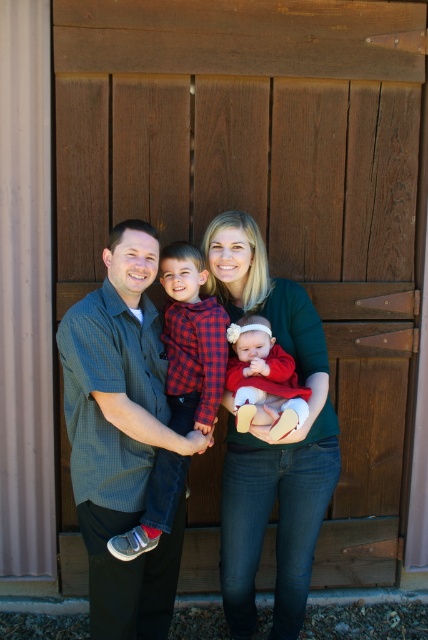
You are a tailor measuring shirts for a family photo. You have two shirts to compare in the image. Which shirt has a larger width between the green checkered shirt at center and the red plaid shirt at center?

The green checkered shirt at center has a larger width than the red plaid shirt at center according to the description.

You are a photographer setting up for a family portrait. You notice two clothing items in the scene that are both at the center. Which clothing item is positioned lower between the matte green sweater at center and the matte red dress at center?

The matte green sweater at center is positioned lower than the matte red dress at center.

You are a photographer standing 1.5 meters away from the camera. You want to take a photo of the green checkered shirt at center. Can you reach the camera to adjust it without moving your position?

The distance between you and the camera is 1.5 meters, and the green checkered shirt at center is 2.18 meters away from the camera. This means the total distance between you and the green checkered shirt at center is 3.68 meters. Since you cannot reach that far without moving, you would need to adjust your position to get closer to the camera or the shirt.